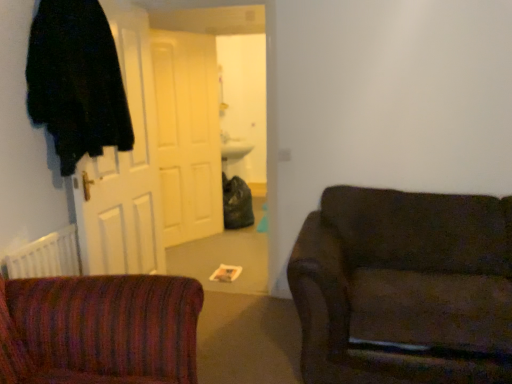
Question: From the image's perspective, would you say black fuzzy robe at left is positioned over white matte door at center, which is the first door from back to front?

Choices:
 (A) yes
 (B) no

Answer: (A)

Question: From a real-world perspective, is black fuzzy robe at left physically above white matte door at center, which is the first door from back to front?

Choices:
 (A) no
 (B) yes

Answer: (B)

Question: Is the depth of black fuzzy robe at left greater than that of white matte door at center, which is the first door from back to front?

Choices:
 (A) no
 (B) yes

Answer: (A)

Question: Is white matte door at center, which is the 2th door from front to back, at the back of black fuzzy robe at left?

Choices:
 (A) yes
 (B) no

Answer: (B)

Question: Can you confirm if black fuzzy robe at left is positioned to the left of white matte door at center, which is the 2th door from front to back?

Choices:
 (A) yes
 (B) no

Answer: (A)

Question: Is black fuzzy robe at left bigger than white matte door at center, which is the first door from back to front?

Choices:
 (A) yes
 (B) no

Answer: (B)

Question: Does white wooden door at left, positioned as the 1th door in front-to-back order, have a larger size compared to dark brown fabric couch at right?

Choices:
 (A) no
 (B) yes

Answer: (A)

Question: From a real-world perspective, does white wooden door at left, the second door in the back-to-front sequence, sit lower than dark brown fabric couch at right?

Choices:
 (A) no
 (B) yes

Answer: (A)

Question: Is white wooden door at left, the second door in the back-to-front sequence, located outside dark brown fabric couch at right?

Choices:
 (A) yes
 (B) no

Answer: (A)

Question: Considering the relative sizes of white wooden door at left, the second door in the back-to-front sequence, and dark brown fabric couch at right in the image provided, is white wooden door at left, the second door in the back-to-front sequence, wider than dark brown fabric couch at right?

Choices:
 (A) no
 (B) yes

Answer: (A)

Question: Is white wooden door at left, the second door in the back-to-front sequence, shorter than dark brown fabric couch at right?

Choices:
 (A) no
 (B) yes

Answer: (A)

Question: From the image's perspective, is white wooden door at left, the second door in the back-to-front sequence, below dark brown fabric couch at right?

Choices:
 (A) no
 (B) yes

Answer: (A)

Question: Is white matte door at center, which is the 2th door from front to back, at the left side of dark brown fabric couch at right?

Choices:
 (A) yes
 (B) no

Answer: (A)